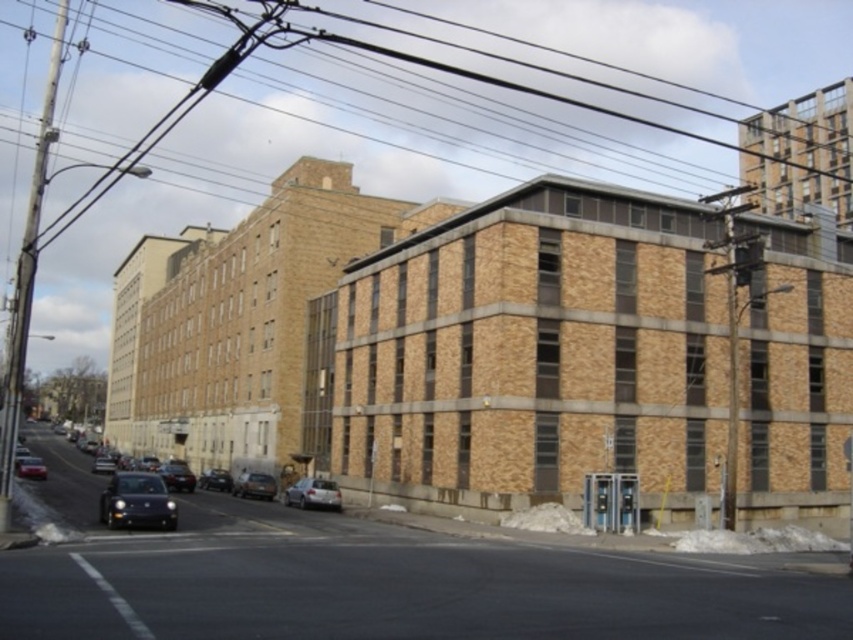
Question: Considering the real-world distances, which object is farthest from the shiny black sedan at center-left?

Choices:
 (A) shiny black sedan at center
 (B) silver metallic car at center
 (C) shiny black sedan at lower left

Answer: (B)

Question: Which point appears farthest from the camera in this image?

Choices:
 (A) (204, 483)
 (B) (332, 496)
 (C) (270, 490)

Answer: (A)

Question: Is satin silver sedan at center below shiny black sedan at center-left?

Choices:
 (A) no
 (B) yes

Answer: (A)

Question: Is silver metallic car at center wider than shiny black sedan at center-left?

Choices:
 (A) yes
 (B) no

Answer: (B)

Question: Is silver metallic car at center closer to camera compared to shiny black sedan at lower left?

Choices:
 (A) yes
 (B) no

Answer: (A)

Question: Estimate the real-world distances between objects in this image. Which object is closer to the shiny black sedan at center-left?

Choices:
 (A) satin silver sedan at center
 (B) shiny black car at lower left

Answer: (A)